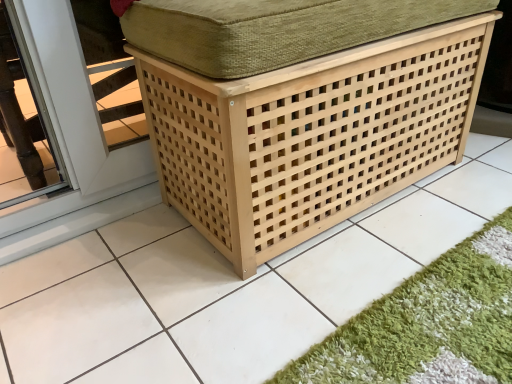
Describe the element at coordinates (426, 325) in the screenshot. The width and height of the screenshot is (512, 384). I see `green shaggy bath mat at lower right` at that location.

Where is `green shaggy bath mat at lower right`? Image resolution: width=512 pixels, height=384 pixels. green shaggy bath mat at lower right is located at coordinates (426, 325).

This screenshot has width=512, height=384. Find the location of `natural wood lattice storage box at center`. natural wood lattice storage box at center is located at coordinates (310, 135).

In order to face natural wood lattice storage box at center, should I rotate leftwards or rightwards?

Rotate right and turn 8.579 degrees.

What is the approximate width of natural wood lattice storage box at center?

natural wood lattice storage box at center is 19.64 inches in width.

Describe the element at coordinates (310, 135) in the screenshot. I see `natural wood lattice storage box at center` at that location.

At what (x,y) coordinates should I click in order to perform the action: click on green shaggy bath mat at lower right. Please return your answer as a coordinate pair (x, y). The height and width of the screenshot is (384, 512). Looking at the image, I should click on [426, 325].

Does natural wood lattice storage box at center appear on the right side of green shaggy bath mat at lower right?

In fact, natural wood lattice storage box at center is to the left of green shaggy bath mat at lower right.

Between natural wood lattice storage box at center and green shaggy bath mat at lower right, which one is positioned in front?

green shaggy bath mat at lower right is closer to the camera.

Which is closer, (362, 126) or (461, 298)?

Positioned in front is point (461, 298).

From the image's perspective, is natural wood lattice storage box at center below green shaggy bath mat at lower right?

No.

From a real-world perspective, is natural wood lattice storage box at center located higher than green shaggy bath mat at lower right?

Yes, from a real-world perspective, natural wood lattice storage box at center is over green shaggy bath mat at lower right

Considering the relative sizes of natural wood lattice storage box at center and green shaggy bath mat at lower right in the image provided, is natural wood lattice storage box at center thinner than green shaggy bath mat at lower right?

No, natural wood lattice storage box at center is not thinner than green shaggy bath mat at lower right.

Between natural wood lattice storage box at center and green shaggy bath mat at lower right, which one has more height?

With more height is natural wood lattice storage box at center.

Considering the sizes of objects natural wood lattice storage box at center and green shaggy bath mat at lower right in the image provided, who is bigger, natural wood lattice storage box at center or green shaggy bath mat at lower right?

natural wood lattice storage box at center is bigger.

Is green shaggy bath mat at lower right surrounded by natural wood lattice storage box at center?

No, green shaggy bath mat at lower right is located outside of natural wood lattice storage box at center.

Is natural wood lattice storage box at center touching green shaggy bath mat at lower right?

No, natural wood lattice storage box at center is not making contact with green shaggy bath mat at lower right.

Could you tell me if natural wood lattice storage box at center is facing green shaggy bath mat at lower right?

Yes, natural wood lattice storage box at center is facing green shaggy bath mat at lower right.

What's the angular difference between natural wood lattice storage box at center and green shaggy bath mat at lower right's facing directions?

They differ by 180 degrees in their facing directions.

Measure the distance from natural wood lattice storage box at center to green shaggy bath mat at lower right.

natural wood lattice storage box at center and green shaggy bath mat at lower right are 17.40 inches apart.

Identify the location of bath mat that appears below the natural wood lattice storage box at center (from a real-world perspective). The height and width of the screenshot is (384, 512). (426, 325).

Can you confirm if green shaggy bath mat at lower right is positioned to the left of natural wood lattice storage box at center?

In fact, green shaggy bath mat at lower right is to the right of natural wood lattice storage box at center.

Which is in front, green shaggy bath mat at lower right or natural wood lattice storage box at center?

green shaggy bath mat at lower right is more forward.

Which point is more forward, (x=354, y=352) or (x=165, y=134)?

The point (x=354, y=352) is in front.

From the image's perspective, is green shaggy bath mat at lower right above or below natural wood lattice storage box at center?

From the image's perspective, green shaggy bath mat at lower right appears below natural wood lattice storage box at center.

From a real-world perspective, is green shaggy bath mat at lower right located higher than natural wood lattice storage box at center?

Actually, green shaggy bath mat at lower right is physically below natural wood lattice storage box at center in the real world.

Is green shaggy bath mat at lower right wider or thinner than natural wood lattice storage box at center?

green shaggy bath mat at lower right is thinner than natural wood lattice storage box at center.

Can you confirm if green shaggy bath mat at lower right is taller than natural wood lattice storage box at center?

Incorrect, the height of green shaggy bath mat at lower right is not larger of that of natural wood lattice storage box at center.

Is green shaggy bath mat at lower right bigger or smaller than natural wood lattice storage box at center?

In the image, green shaggy bath mat at lower right appears to be smaller than natural wood lattice storage box at center.

Is green shaggy bath mat at lower right surrounding natural wood lattice storage box at center?

No, natural wood lattice storage box at center is not inside green shaggy bath mat at lower right.

Is green shaggy bath mat at lower right placed right next to natural wood lattice storage box at center?

No, green shaggy bath mat at lower right is not next to natural wood lattice storage box at center.

Is green shaggy bath mat at lower right turned away from natural wood lattice storage box at center?

No, green shaggy bath mat at lower right is not facing away from natural wood lattice storage box at center.

Measure the distance from green shaggy bath mat at lower right to natural wood lattice storage box at center.

17.40 inches.

What are the coordinates of `bath mat in front of the natural wood lattice storage box at center` in the screenshot? It's located at (426, 325).

The width and height of the screenshot is (512, 384). I want to click on furniture behind the green shaggy bath mat at lower right, so click(x=310, y=135).

Image resolution: width=512 pixels, height=384 pixels. Identify the location of bath mat that is on the right side of natural wood lattice storage box at center. (426, 325).